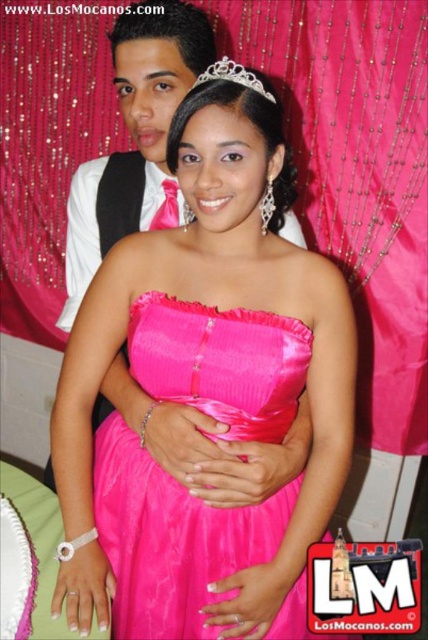
You are a photographer at the event and want to capture a photo where both the satin dress at center and the silver metallic tiara at upper center are clearly visible. Based on their positions, which object should you ensure is closer to the left side of the frame?

The satin dress at center is to the left of the silver metallic tiara at upper center, so to ensure both are visible, position the satin dress at center on the left side of the frame and the silver metallic tiara at upper center on the right side.

From the picture: You are a photographer at the event and need to frame a closeup shot of both the pink satin dress at center and the silver metallic tiara at upper center. Given the camera lens you have, which has a limited field of view, can you fit both objects in the frame at the same time?

The pink satin dress at center is wider than the silver metallic tiara at upper center, so it depends on the specific dimensions of the dress and tiara. However, since the dress is larger, it may take up more space in the frame, making it challenging to include both objects simultaneously without zooming out or adjusting the camera angle.